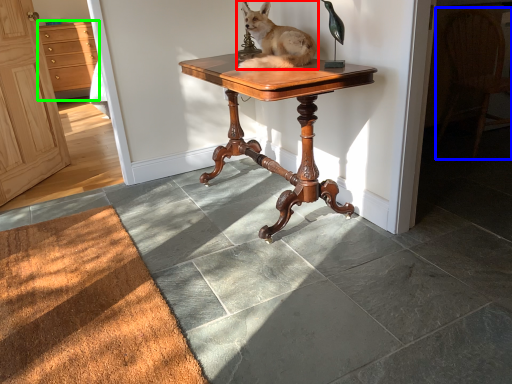
Question: Based on their relative distances, which object is farther from dog (highlighted by a red box)? Choose from chair (highlighted by a blue box) and cabinetry (highlighted by a green box).

Choices:
 (A) chair
 (B) cabinetry

Answer: (B)